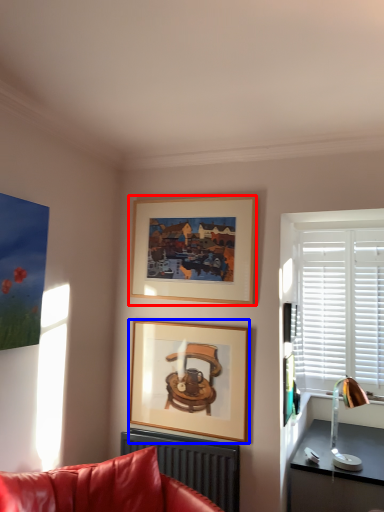
Question: Which of the following is the closest to the observer, picture frame (highlighted by a red box) or picture frame (highlighted by a blue box)?

Choices:
 (A) picture frame
 (B) picture frame

Answer: (B)